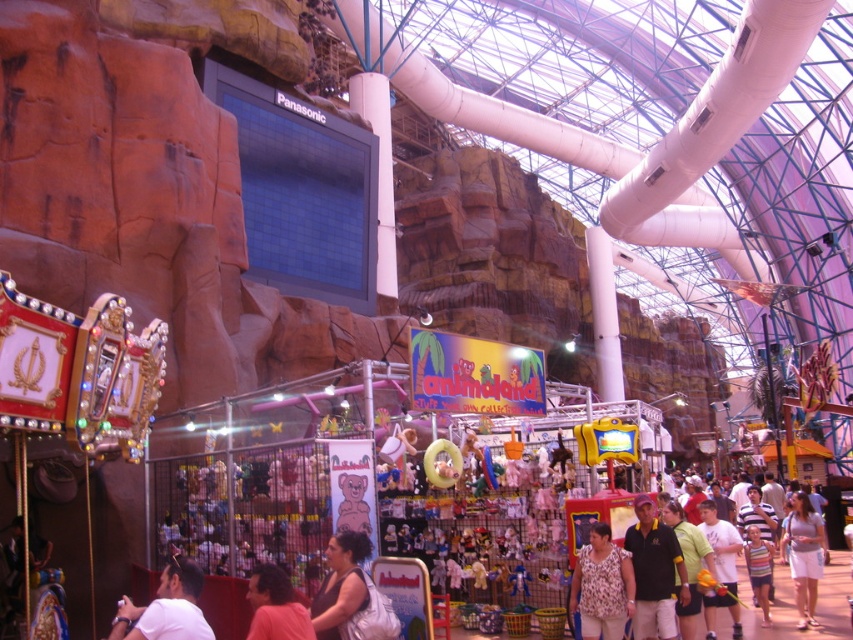
Can you confirm if white matte shirt at lower left is bigger than light purple fabric dress at lower right?

Yes.

Who is more forward, [193,628] or [781,552]?

Point [193,628] is more forward.

Describe the element at coordinates (166, 608) in the screenshot. I see `white matte shirt at lower left` at that location.

This screenshot has width=853, height=640. Identify the location of white matte shirt at lower left. (166, 608).

Does point (339, 544) come closer to viewer compared to point (585, 538)?

Yes, it is in front of point (585, 538).

What do you see at coordinates (341, 584) in the screenshot? I see `matte white backpack at center` at bounding box center [341, 584].

You are a GUI agent. You are given a task and a screenshot of the screen. Output one action in this format:
    pyautogui.click(x=<x>, y=<y>)
    Task: Click on the matte white backpack at center
    Image resolution: width=853 pixels, height=640 pixels.
    Given the screenshot: What is the action you would take?
    pyautogui.click(x=341, y=584)

Does white matte shirt at lower left have a larger size compared to light brown shorts at lower right?

Actually, white matte shirt at lower left might be smaller than light brown shorts at lower right.

This screenshot has width=853, height=640. Describe the element at coordinates (166, 608) in the screenshot. I see `white matte shirt at lower left` at that location.

Who is more forward, (x=201, y=573) or (x=666, y=525)?

Point (x=201, y=573)

Locate an element on the screen. white matte shirt at lower left is located at coordinates (166, 608).